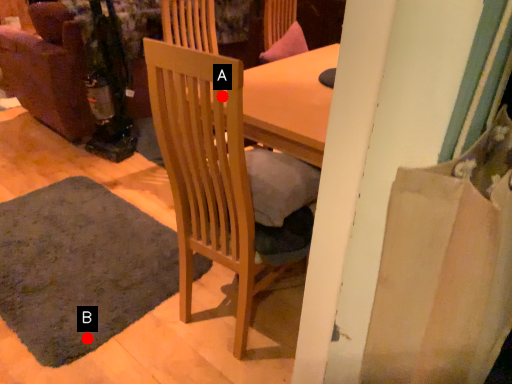
Question: Two points are circled on the image, labeled by A and B beside each circle. Which point is closer to the camera?

Choices:
 (A) A is closer
 (B) B is closer

Answer: (A)